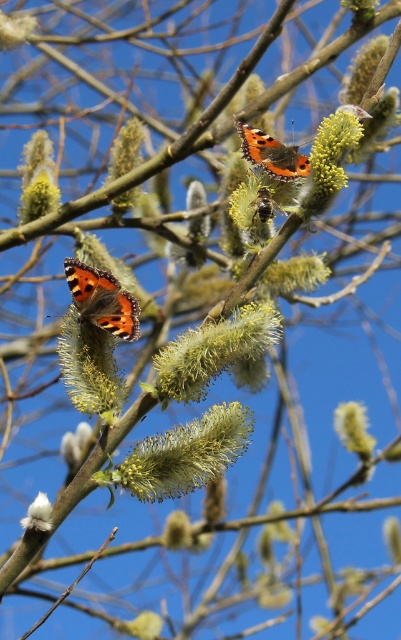
Who is positioned more to the right, fluffy white flower at center or white fluffy flower at lower left?

fluffy white flower at center is more to the right.

Which is behind, point (81, 451) or point (38, 516)?

Positioned behind is point (81, 451).

The image size is (401, 640). I want to click on fluffy white flower at center, so click(76, 444).

The height and width of the screenshot is (640, 401). I want to click on fluffy white flower at center, so click(x=76, y=444).

Looking at this image, is fuzzy yellow flower at center taller than fluffy white flower at center?

Indeed, fuzzy yellow flower at center has a greater height compared to fluffy white flower at center.

Is fuzzy yellow flower at center shorter than fluffy white flower at center?

No, fuzzy yellow flower at center is not shorter than fluffy white flower at center.

Between point (210, 413) and point (85, 444), which one is positioned behind?

Point (85, 444)

Identify the location of fuzzy yellow flower at center. (186, 452).

In the scene shown: Is yellow fluffy catkin at upper left taller than soft yellow fluff at upper left?

Yes.

Is yellow fluffy catkin at upper left smaller than soft yellow fluff at upper left?

No, yellow fluffy catkin at upper left is not smaller than soft yellow fluff at upper left.

Is point (24, 170) farther from viewer compared to point (10, 29)?

Yes.

At what (x,y) coordinates should I click in order to perform the action: click on yellow fluffy catkin at upper left. Please return your answer as a coordinate pair (x, y). Looking at the image, I should click on (38, 179).